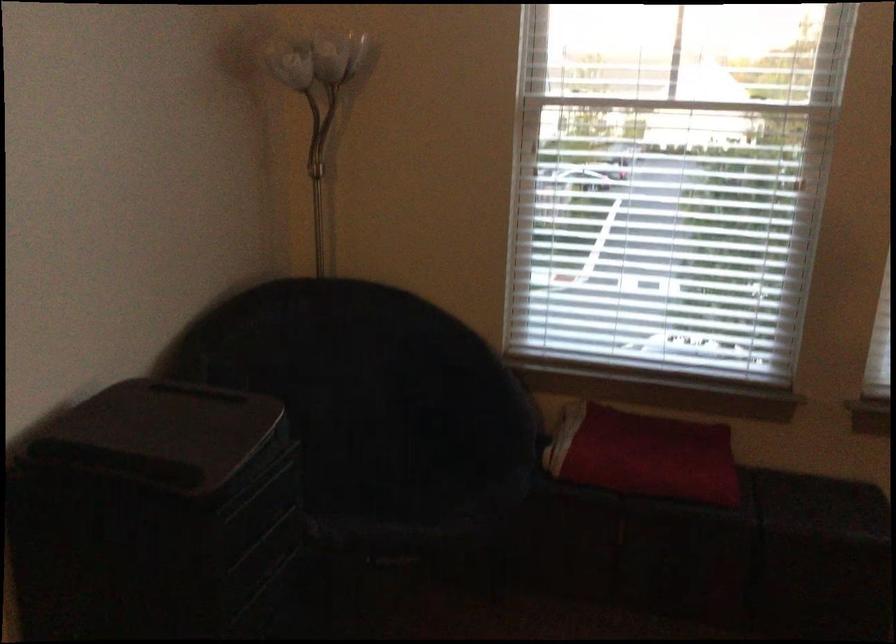
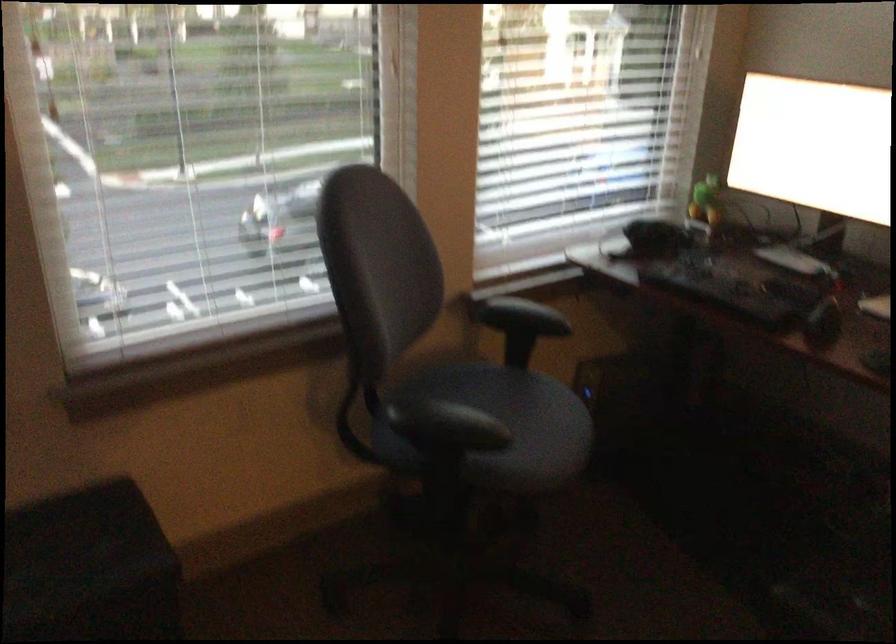
Question: Based on the continuous images, in which direction is the camera rotating? Reply with the corresponding letter.

Choices:
 (A) Left
 (B) Right
 (C) Up
 (D) Down

Answer: (B)